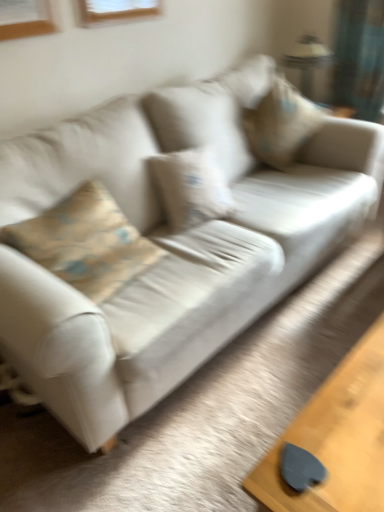
This screenshot has height=512, width=384. Identify the location of beige fabric pillow at upper right. tap(280, 123).

This screenshot has width=384, height=512. Identify the location of metallic silver lamp at upper right. (308, 60).

What is the approximate height of smooth wooden table at lower right?

smooth wooden table at lower right is 17.75 inches in height.

Locate an element on the screen. This screenshot has width=384, height=512. beige fabric pillow at upper right is located at coordinates (280, 123).

Considering the sizes of objects beige fabric pillow at upper right and smooth wooden table at lower right in the image provided, who is wider, beige fabric pillow at upper right or smooth wooden table at lower right?

beige fabric pillow at upper right.

In the scene shown: Is beige fabric pillow at upper right touching smooth wooden table at lower right?

No, beige fabric pillow at upper right is not beside smooth wooden table at lower right.

In terms of size, does beige fabric pillow at upper right appear bigger or smaller than smooth wooden table at lower right?

beige fabric pillow at upper right is bigger than smooth wooden table at lower right.

Is smooth wooden table at lower right shorter than beige fabric pillow at upper right?

Correct, smooth wooden table at lower right is not as tall as beige fabric pillow at upper right.

Are smooth wooden table at lower right and beige fabric pillow at upper right far apart?

smooth wooden table at lower right is positioned a significant distance from beige fabric pillow at upper right.

Does point (325, 414) appear closer or farther from the camera than point (256, 125)?

Clearly, point (325, 414) is closer to the camera than point (256, 125).

Does metallic silver lamp at upper right appear on the left side of beige fabric pillow at upper right?

In fact, metallic silver lamp at upper right is to the right of beige fabric pillow at upper right.

From the image's perspective, is metallic silver lamp at upper right above or below beige fabric pillow at upper right?

Clearly, from the image's perspective, metallic silver lamp at upper right is above beige fabric pillow at upper right.

From a real-world perspective, is metallic silver lamp at upper right physically located above or below beige fabric pillow at upper right?

From a real-world perspective, metallic silver lamp at upper right is physically above beige fabric pillow at upper right.

Is metallic silver lamp at upper right beside beige fabric pillow at upper right?

They are not placed beside each other.

Would you say metallic silver lamp at upper right is outside smooth wooden table at lower right?

Yes, metallic silver lamp at upper right is located beyond the bounds of smooth wooden table at lower right.

Considering the positions of objects metallic silver lamp at upper right and smooth wooden table at lower right in the image provided, who is more to the left, metallic silver lamp at upper right or smooth wooden table at lower right?

From the viewer's perspective, smooth wooden table at lower right appears more on the left side.

Is metallic silver lamp at upper right next to smooth wooden table at lower right and touching it?

metallic silver lamp at upper right is not next to smooth wooden table at lower right, and they're not touching.

Considering the relative positions of smooth wooden table at lower right and metallic silver lamp at upper right in the image provided, is smooth wooden table at lower right to the left or to the right of metallic silver lamp at upper right?

In the image, smooth wooden table at lower right appears on the left side of metallic silver lamp at upper right.

From a real-world perspective, is smooth wooden table at lower right located beneath metallic silver lamp at upper right?

Yes, from a real-world perspective, smooth wooden table at lower right is below metallic silver lamp at upper right.

How far apart are smooth wooden table at lower right and metallic silver lamp at upper right?

The distance of smooth wooden table at lower right from metallic silver lamp at upper right is 8.42 feet.

Considering the relative sizes of smooth wooden table at lower right and metallic silver lamp at upper right in the image provided, is smooth wooden table at lower right bigger than metallic silver lamp at upper right?

Correct, smooth wooden table at lower right is larger in size than metallic silver lamp at upper right.

Does beige fabric pillow at upper right appear on the right side of metallic silver lamp at upper right?

No.

Based on the photo, could metallic silver lamp at upper right be considered to be inside beige fabric pillow at upper right?

No, metallic silver lamp at upper right is not inside beige fabric pillow at upper right.

Is the depth of beige fabric pillow at upper right greater than that of metallic silver lamp at upper right?

No, it is in front of metallic silver lamp at upper right.

Where is `pillow below the metallic silver lamp at upper right (from a real-world perspective)`? This screenshot has height=512, width=384. pillow below the metallic silver lamp at upper right (from a real-world perspective) is located at coordinates (280, 123).

Where is `table below the beige fabric pillow at upper right (from a real-world perspective)`? table below the beige fabric pillow at upper right (from a real-world perspective) is located at coordinates (336, 438).

Find the location of `table that is below the beige fabric pillow at upper right (from the image's perspective)`. table that is below the beige fabric pillow at upper right (from the image's perspective) is located at coordinates (336, 438).

From the image, which object appears to be farther from smooth wooden table at lower right, beige fabric pillow at upper right or metallic silver lamp at upper right?

metallic silver lamp at upper right.

Considering their positions, is smooth wooden table at lower right positioned further to metallic silver lamp at upper right than beige fabric pillow at upper right?

The object further to metallic silver lamp at upper right is smooth wooden table at lower right.

Which object lies further to the anchor point smooth wooden table at lower right, metallic silver lamp at upper right or beige fabric pillow at upper right?

The object further to smooth wooden table at lower right is metallic silver lamp at upper right.

Looking at this image, when comparing their distances from beige fabric pillow at upper right, does metallic silver lamp at upper right or smooth wooden table at lower right seem closer?

metallic silver lamp at upper right lies closer to beige fabric pillow at upper right than the other object.

When comparing their distances from beige fabric pillow at upper right, does smooth wooden table at lower right or metallic silver lamp at upper right seem closer?

metallic silver lamp at upper right is positioned closer to the anchor beige fabric pillow at upper right.

Which object lies further to the anchor point metallic silver lamp at upper right, beige fabric pillow at upper right or smooth wooden table at lower right?

smooth wooden table at lower right lies further to metallic silver lamp at upper right than the other object.

This screenshot has width=384, height=512. Identify the location of pillow between metallic silver lamp at upper right and smooth wooden table at lower right in the up-down direction. (280, 123).